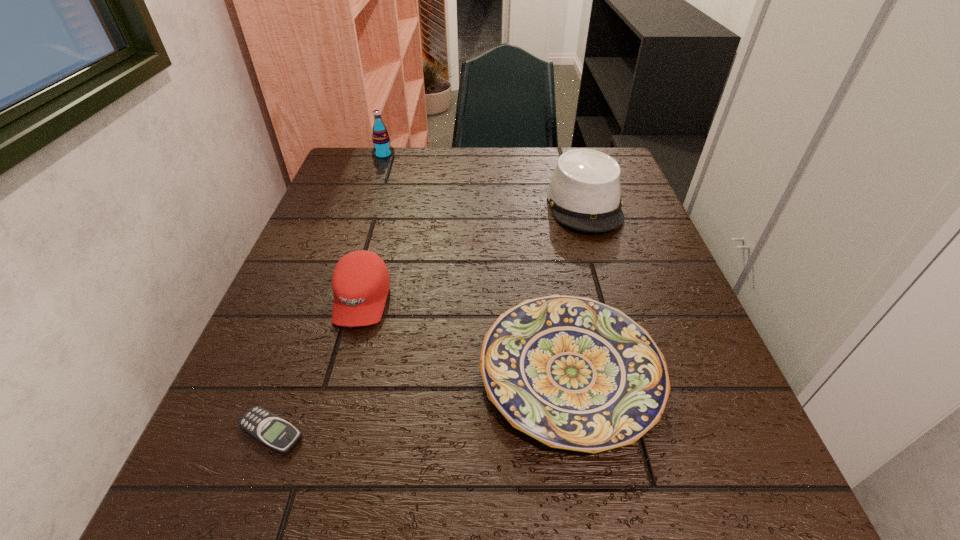
This screenshot has height=540, width=960. Find the location of `free space located on the back of the fourth tallest object`. free space located on the back of the fourth tallest object is located at coordinates (554, 285).

Locate an element on the screen. This screenshot has width=960, height=540. soda that is at the far edge is located at coordinates [x=382, y=149].

Where is `hat that is at the far edge`? The image size is (960, 540). hat that is at the far edge is located at coordinates (584, 193).

You are a GUI agent. You are given a task and a screenshot of the screen. Output one action in this format:
    pyautogui.click(x=<x>, y=<y>)
    Task: Click on the soda that is at the left edge
    This screenshot has width=960, height=540.
    Given the screenshot: What is the action you would take?
    pyautogui.click(x=382, y=149)

I want to click on cap situated at the left edge, so click(360, 282).

Where is `beeper present at the left edge`? The image size is (960, 540). beeper present at the left edge is located at coordinates (271, 430).

Where is `hat at the right edge`? hat at the right edge is located at coordinates (584, 193).

This screenshot has height=540, width=960. Identify the location of plate situated at the right edge. (573, 373).

I want to click on object that is at the far left corner, so click(x=382, y=149).

You are a GUI agent. You are given a task and a screenshot of the screen. Output one action in this format:
    pyautogui.click(x=<x>, y=<y>)
    Task: Click on the object located in the far right corner section of the desktop
    This screenshot has width=960, height=540.
    Given the screenshot: What is the action you would take?
    pyautogui.click(x=584, y=193)